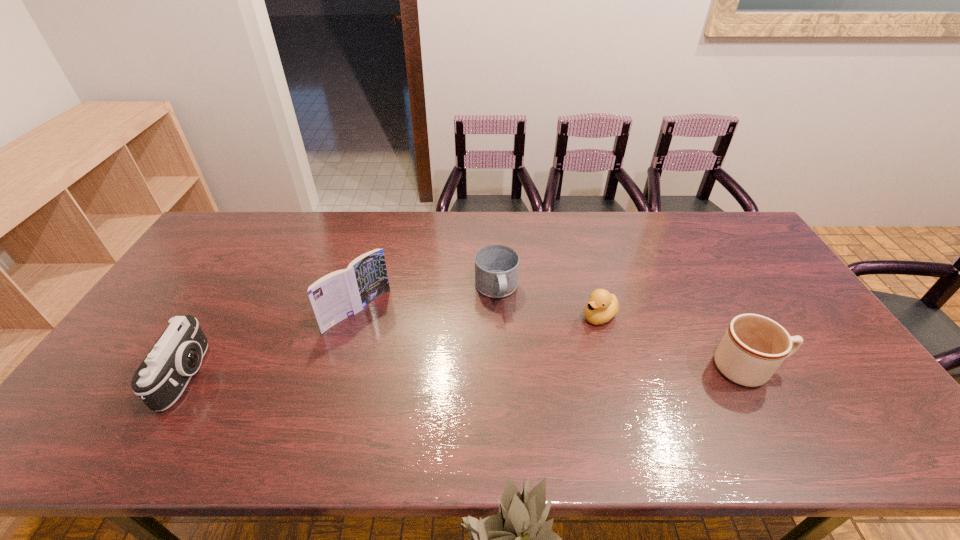
Locate an element on the screen. vacant point located between the rightmost object and the camera is located at coordinates (468, 372).

Image resolution: width=960 pixels, height=540 pixels. What are the coordinates of `vacant point located between the nearer mug and the tallest object` in the screenshot? It's located at (x=553, y=340).

This screenshot has width=960, height=540. In order to click on free space between the third object from left to right and the duckling in this screenshot , I will do `click(548, 302)`.

Find the location of a particular element. vacant area that lies between the taller mug and the shorter mug is located at coordinates click(x=622, y=329).

I want to click on free spot between the duckling and the nearer mug, so click(674, 342).

What are the coordinates of `free point between the leftmost object and the duckling` in the screenshot? It's located at (394, 345).

Locate an element on the screen. Image resolution: width=960 pixels, height=540 pixels. free spot between the second object from right to left and the shorter mug is located at coordinates (548, 302).

Identify the location of object that is the second closest one to the nearer mug. This screenshot has height=540, width=960. (496, 266).

Select which object appears as the third closest to the rightmost object. Please provide its 2D coordinates. Your answer should be formatted as a tuple, i.e. [(x, y)], where the tuple contains the x and y coordinates of a point satisfying the conditions above.

[(338, 295)]